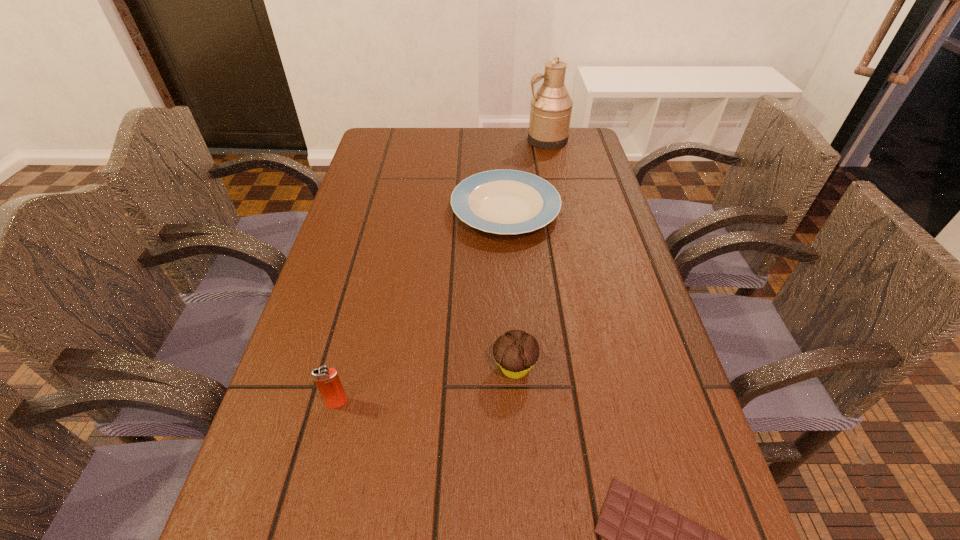
In the image, there is a desktop. Where is `vacant space at the far left corner`? The width and height of the screenshot is (960, 540). vacant space at the far left corner is located at coordinates (406, 145).

This screenshot has width=960, height=540. In order to click on free spot at the far right corner of the desktop in this screenshot , I will do `click(568, 142)`.

Locate an element on the screen. vacant point located between the leftmost object and the tallest object is located at coordinates (442, 271).

Identify the location of free space between the igniter and the fourth nearest object. The image size is (960, 540). (421, 306).

You are a GUI agent. You are given a task and a screenshot of the screen. Output one action in this format:
    pyautogui.click(x=<x>, y=<y>)
    Task: Click on the blank region between the plate and the igniter
    
    Given the screenshot: What is the action you would take?
    pyautogui.click(x=421, y=306)

Locate an element on the screen. free space between the fourth nearest object and the muffin is located at coordinates click(x=510, y=289).

The width and height of the screenshot is (960, 540). Find the location of `vacant area that lies between the farthest object and the igniter`. vacant area that lies between the farthest object and the igniter is located at coordinates (442, 271).

Image resolution: width=960 pixels, height=540 pixels. I want to click on the second closest object to the pitcher, so click(x=516, y=352).

Locate which object is the fourth closest to the third nearest object. Please provide its 2D coordinates. Your answer should be formatted as a tuple, i.e. [(x, y)], where the tuple contains the x and y coordinates of a point satisfying the conditions above.

[(550, 113)]

Where is `vacant space that satisfies the following two spatial constraints: 1. on the back side of the third farthest object; 2. on the left side of the plate`? vacant space that satisfies the following two spatial constraints: 1. on the back side of the third farthest object; 2. on the left side of the plate is located at coordinates (504, 210).